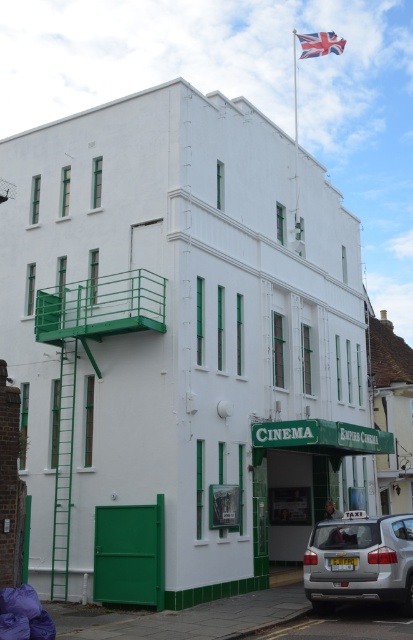
You are a pedestrian standing on the sidewalk in front of the Empire Cinema. You see the silver metallic taxi at lower right and the union jack fabric at upper center. Which object is positioned to the left of the other?

The silver metallic taxi at lower right is to the left of the union jack fabric at upper center.

You are a pedestrian standing in front of the Empire Cinema building. You notice a silver metallic taxi at lower right and a union jack fabric at upper center. Which object is positioned higher from the ground?

The union jack fabric at upper center is positioned higher from the ground than the silver metallic taxi at lower right.

You are a delivery person trying to park your 2.5 meters tall delivery van. You see the silver metallic taxi at lower right and the union jack fabric at upper center. Which object is taller and could block your van from passing underneath?

The union jack fabric at upper center is taller than the silver metallic taxi at lower right, so it could block the van from passing underneath.